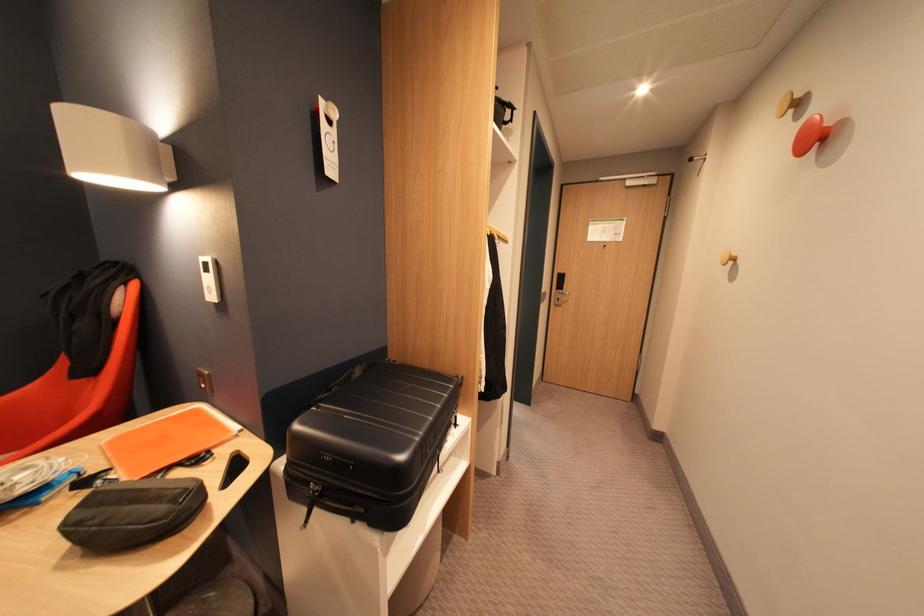
What do you see at coordinates (439, 456) in the screenshot? Image resolution: width=924 pixels, height=616 pixels. I see `the suitcase zipper pull` at bounding box center [439, 456].